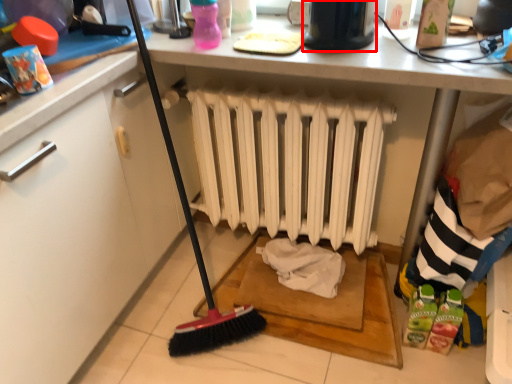
Question: From the image, what is the correct spatial relationship of appliance (annotated by the red box) in relation to radiator?

Choices:
 (A) right
 (B) left

Answer: (A)